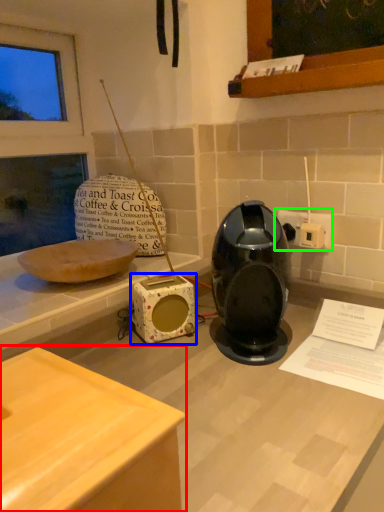
Question: Which object is the closest to the table (highlighted by a red box)? Choose among these: appliance (highlighted by a blue box) or electric outlet (highlighted by a green box).

Choices:
 (A) appliance
 (B) electric outlet

Answer: (A)